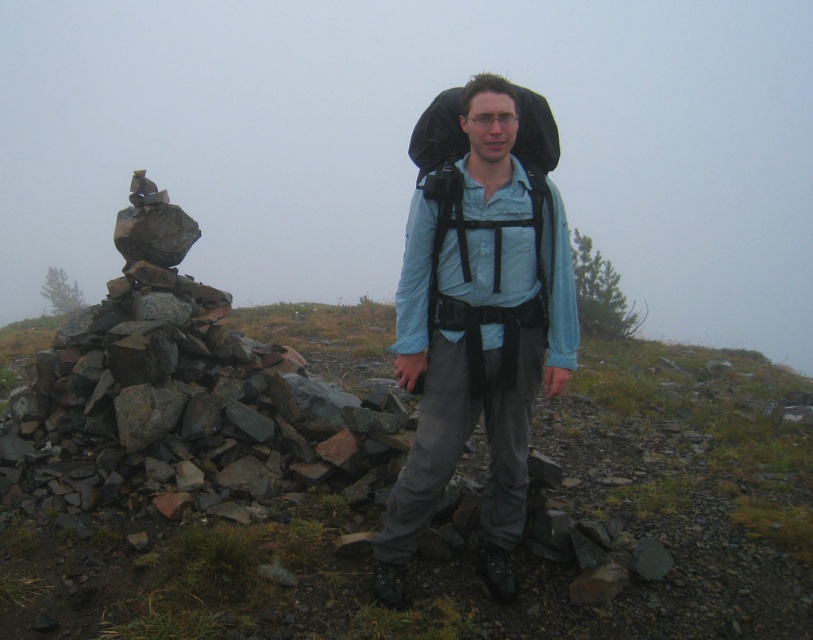
You are a drone operator trying to capture a photo of the matte black backpack at center from above. The drone is currently at coordinates point A. To ensure the backpack is centered in the photo, where should the drone fly to? Please provide coordinates in the format point X.

The drone should fly to point (477, 332) to center the matte black backpack at center in the photo.

You are a hiker who wants to place your backpack on the ground near the cairn. You have two backpacks, the matte black backpack at center and the black fabric backpack at center. If you want to place them side by side, will they fit within a 12 feet space?

The matte black backpack at center and the black fabric backpack at center are 10.96 feet apart from each other. Since 10.96 feet is less than 12 feet, they can fit within the 12 feet space when placed side by side.